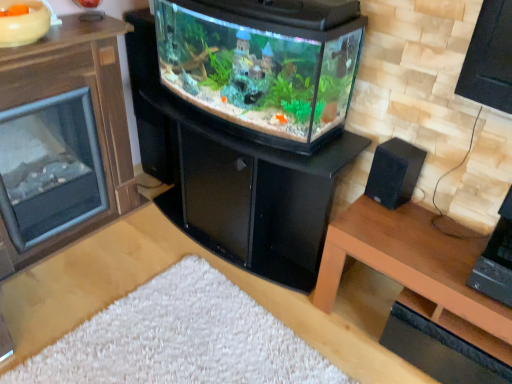
Question: Is brown wood fireplace at left at the back of black glossy fireplace at center?

Choices:
 (A) yes
 (B) no

Answer: (B)

Question: Can you confirm if black glossy fireplace at center is positioned to the left of brown wood fireplace at left?

Choices:
 (A) yes
 (B) no

Answer: (B)

Question: Is black glossy fireplace at center next to brown wood fireplace at left and touching it?

Choices:
 (A) yes
 (B) no

Answer: (B)

Question: Does black glossy fireplace at center have a lesser width compared to brown wood fireplace at left?

Choices:
 (A) yes
 (B) no

Answer: (B)

Question: Is brown wood fireplace at left inside black glossy fireplace at center?

Choices:
 (A) no
 (B) yes

Answer: (A)

Question: From a real-world perspective, is black glossy fireplace at center physically below brown wood fireplace at left?

Choices:
 (A) no
 (B) yes

Answer: (B)

Question: From a real-world perspective, does black matte speaker at right stand above brown wood table at lower right?

Choices:
 (A) no
 (B) yes

Answer: (B)

Question: From a real-world perspective, does black matte speaker at right sit lower than brown wood table at lower right?

Choices:
 (A) no
 (B) yes

Answer: (A)

Question: Is black matte speaker at right beside brown wood table at lower right?

Choices:
 (A) yes
 (B) no

Answer: (B)

Question: Could you tell me if black matte speaker at right is turned towards brown wood table at lower right?

Choices:
 (A) no
 (B) yes

Answer: (A)

Question: Can you confirm if black matte speaker at right is bigger than brown wood table at lower right?

Choices:
 (A) no
 (B) yes

Answer: (A)

Question: Is black matte speaker at right wider than brown wood table at lower right?

Choices:
 (A) yes
 (B) no

Answer: (B)

Question: From a real-world perspective, is black glossy fireplace at center under black matte speaker at right?

Choices:
 (A) no
 (B) yes

Answer: (B)